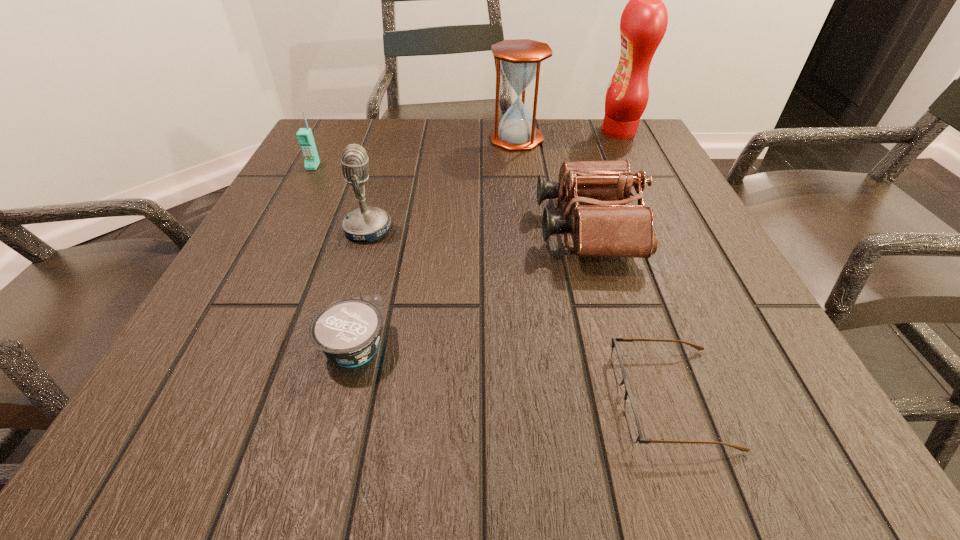
Where is `condiment`? Image resolution: width=960 pixels, height=540 pixels. condiment is located at coordinates (643, 24).

The image size is (960, 540). Find the location of `hourglass`. hourglass is located at coordinates (520, 59).

Locate an element on the screen. This screenshot has width=960, height=540. microphone is located at coordinates (366, 223).

Where is `the leftmost object`? The width and height of the screenshot is (960, 540). the leftmost object is located at coordinates (305, 138).

Find the location of a particular element. The image size is (960, 540). the fifth nearest object is located at coordinates (305, 138).

This screenshot has width=960, height=540. In order to click on binoculars in this screenshot , I will do `click(609, 228)`.

Find the location of a particular element. The height and width of the screenshot is (540, 960). yogurt is located at coordinates (347, 331).

Identify the location of spectacles. The image size is (960, 540). (631, 415).

Image resolution: width=960 pixels, height=540 pixels. In order to click on free location located on the label side of the condiment in this screenshot , I will do [518, 132].

This screenshot has height=540, width=960. Find the location of `free point located 0.240m on the label side of the condiment`. free point located 0.240m on the label side of the condiment is located at coordinates (507, 132).